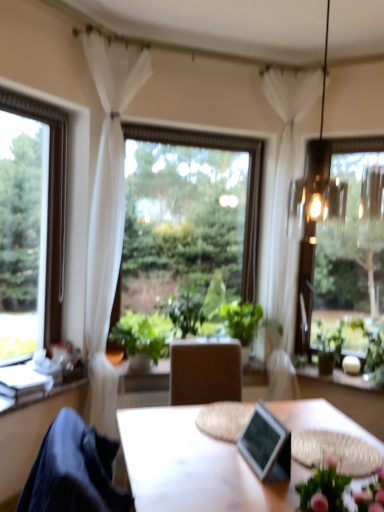
Question: Can you confirm if green leafy plant at right, the 1th houseplant from the right, is positioned to the right of metallic silver picture frame at center?

Choices:
 (A) yes
 (B) no

Answer: (A)

Question: Is green leafy plant at right, which is the third houseplant in left-to-right order, at the left side of metallic silver picture frame at center?

Choices:
 (A) yes
 (B) no

Answer: (B)

Question: Could you tell me if green leafy plant at right, the 1th houseplant from the right, is facing metallic silver picture frame at center?

Choices:
 (A) yes
 (B) no

Answer: (A)

Question: From the image's perspective, would you say green leafy plant at right, the 1th houseplant from the right, is shown under metallic silver picture frame at center?

Choices:
 (A) no
 (B) yes

Answer: (A)

Question: From a real-world perspective, is green leafy plant at right, the 1th houseplant from the right, below metallic silver picture frame at center?

Choices:
 (A) no
 (B) yes

Answer: (B)

Question: From a real-world perspective, relative to green leafy plant at right, which is the third houseplant in left-to-right order, is metallic silver picture frame at center vertically above or below?

Choices:
 (A) above
 (B) below

Answer: (A)

Question: Considering the positions of point (259, 424) and point (336, 330), is point (259, 424) closer or farther from the camera than point (336, 330)?

Choices:
 (A) farther
 (B) closer

Answer: (B)

Question: Considering the relative positions of metallic silver picture frame at center and green leafy plant at right, the 1th houseplant from the right, in the image provided, is metallic silver picture frame at center to the left or to the right of green leafy plant at right, the 1th houseplant from the right,?

Choices:
 (A) right
 (B) left

Answer: (B)

Question: Is metallic silver picture frame at center taller or shorter than green leafy plant at right, which is the third houseplant in left-to-right order?

Choices:
 (A) short
 (B) tall

Answer: (A)

Question: Relative to dark blue fabric at lower left, is green leafy plant at center, arranged as the third houseplant when viewed from the right, in front or behind?

Choices:
 (A) behind
 (B) front

Answer: (A)

Question: From the image's perspective, relative to dark blue fabric at lower left, is green leafy plant at center, arranged as the third houseplant when viewed from the right, above or below?

Choices:
 (A) above
 (B) below

Answer: (A)

Question: In terms of height, does green leafy plant at center, arranged as the third houseplant when viewed from the right, look taller or shorter compared to dark blue fabric at lower left?

Choices:
 (A) tall
 (B) short

Answer: (B)

Question: From a real-world perspective, is green leafy plant at center, arranged as the third houseplant when viewed from the right, positioned above or below dark blue fabric at lower left?

Choices:
 (A) below
 (B) above

Answer: (B)

Question: In terms of height, does dark blue fabric at lower left look taller or shorter compared to green leafy plant at right, the 1th houseplant from the right?

Choices:
 (A) short
 (B) tall

Answer: (B)

Question: Does point pyautogui.click(x=51, y=453) appear closer or farther from the camera than point pyautogui.click(x=337, y=334)?

Choices:
 (A) closer
 (B) farther

Answer: (A)